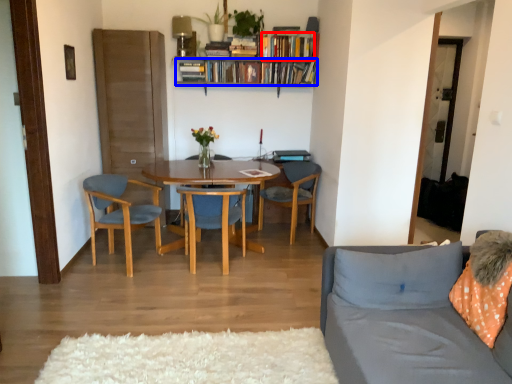
Question: Which point is further to the camera, book (highlighted by a red box) or book (highlighted by a blue box)?

Choices:
 (A) book
 (B) book

Answer: (B)